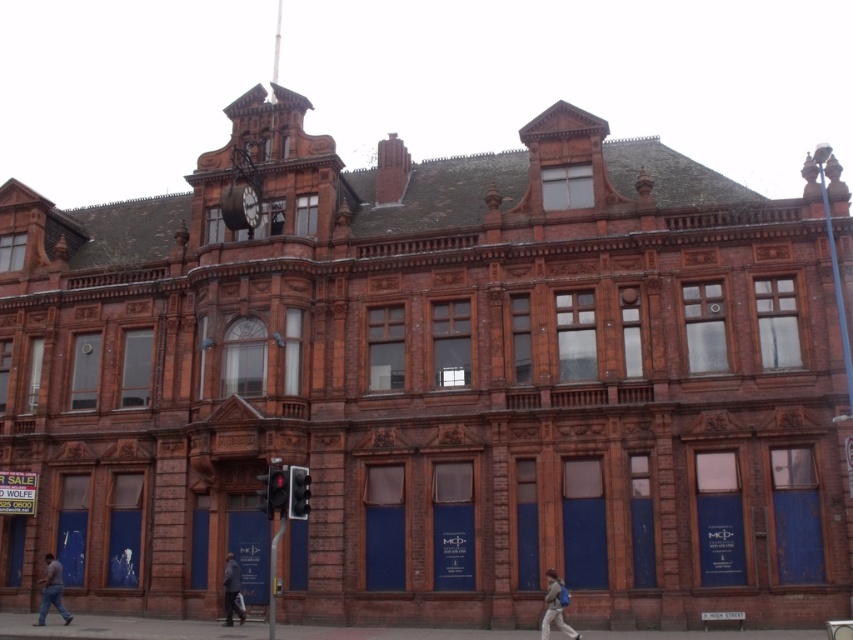
Is matte brown clock at upper center taller than dark brown leather coat at lower center?

Incorrect, matte brown clock at upper center's height is not larger of dark brown leather coat at lower center's.

Does matte brown clock at upper center appear on the left side of dark brown leather coat at lower center?

Indeed, matte brown clock at upper center is positioned on the left side of dark brown leather coat at lower center.

Does point (228, 220) lie behind point (242, 618)?

Yes, point (228, 220) is farther from viewer.

Where is `matte brown clock at upper center`? The image size is (853, 640). matte brown clock at upper center is located at coordinates (241, 208).

Measure the distance between matte gray jacket at lower right and dark brown leather coat at lower center.

matte gray jacket at lower right is 58.40 feet from dark brown leather coat at lower center.

Who is more forward, (553, 598) or (242, 618)?

Positioned in front is point (553, 598).

Who is more distant from viewer, [556,577] or [228,598]?

Point [228,598]

Where is `matte gray jacket at lower right`? matte gray jacket at lower right is located at coordinates (554, 608).

Which is more to the left, matte brown clock at upper center or metallic clock at upper center?

Positioned to the left is matte brown clock at upper center.

Is matte brown clock at upper center shorter than metallic clock at upper center?

Yes.

At what (x,y) coordinates should I click in order to perform the action: click on matte brown clock at upper center. Please return your answer as a coordinate pair (x, y). Looking at the image, I should click on (241, 208).